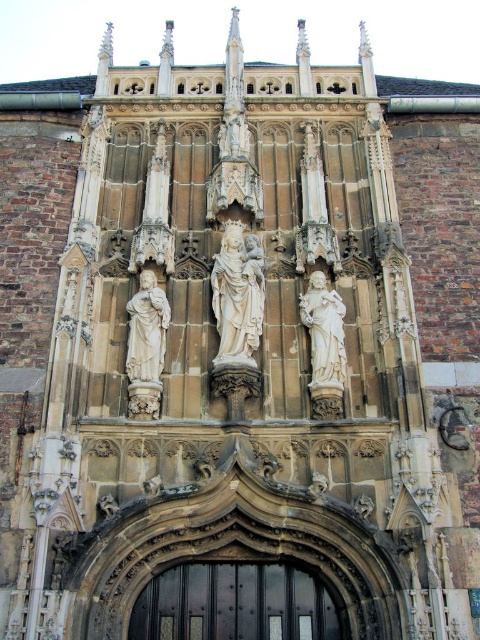
You are an architect visiting this Gothic building and want to install a new decorative element between the black wood door at center and the white marble statue at center. Which object should you place closer to the door to ensure it doesn

The black wood door at center is wider than the white marble statue at center. To place the decorative element closer to the door, you should position it near the door since it has a larger width, allowing more space for placement.

You are an art student analyzing the Gothic building facade. You notice two statues at the center of the facade. The first is labeled as a white stone statue at center, and the second is a white marble statue at center. Which of these two statues is bigger?

The white stone statue at center is larger in size compared to the white marble statue at center.